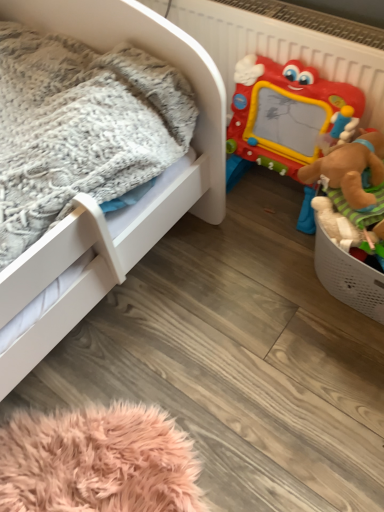
Question: Is plastic drawing board at right closer to the viewer compared to white matte infant bed at left?

Choices:
 (A) no
 (B) yes

Answer: (A)

Question: Can you confirm if plastic drawing board at right is positioned to the right of white matte infant bed at left?

Choices:
 (A) yes
 (B) no

Answer: (A)

Question: Is plastic drawing board at right turned away from white matte infant bed at left?

Choices:
 (A) yes
 (B) no

Answer: (B)

Question: Does plastic drawing board at right have a greater width compared to white matte infant bed at left?

Choices:
 (A) no
 (B) yes

Answer: (A)

Question: Is plastic drawing board at right outside white matte infant bed at left?

Choices:
 (A) yes
 (B) no

Answer: (A)

Question: Are plastic drawing board at right and white matte infant bed at left far apart?

Choices:
 (A) yes
 (B) no

Answer: (B)

Question: From a real-world perspective, is white matte infant bed at left over plastic drawing board at right?

Choices:
 (A) no
 (B) yes

Answer: (B)

Question: From the image's perspective, is white matte infant bed at left located above plastic drawing board at right?

Choices:
 (A) yes
 (B) no

Answer: (B)

Question: Is the position of white matte infant bed at left more distant than that of plastic drawing board at right?

Choices:
 (A) no
 (B) yes

Answer: (A)

Question: Can you confirm if white matte infant bed at left is smaller than plastic drawing board at right?

Choices:
 (A) no
 (B) yes

Answer: (A)

Question: Is white matte infant bed at left located outside plastic drawing board at right?

Choices:
 (A) no
 (B) yes

Answer: (B)

Question: Could you tell me if white matte infant bed at left is facing plastic drawing board at right?

Choices:
 (A) no
 (B) yes

Answer: (A)

Question: From the image's perspective, is plastic drawing board at right above or below white matte infant bed at left?

Choices:
 (A) above
 (B) below

Answer: (A)